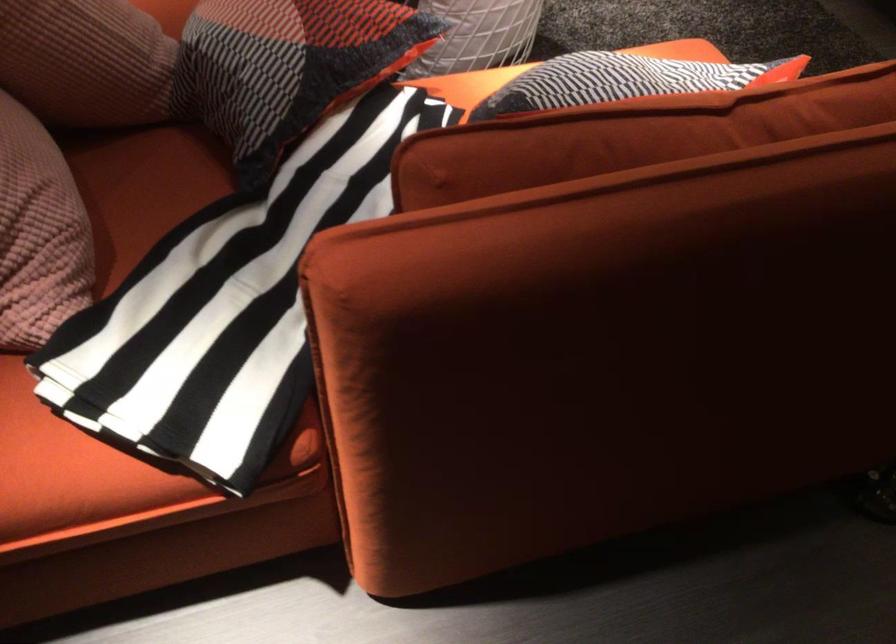
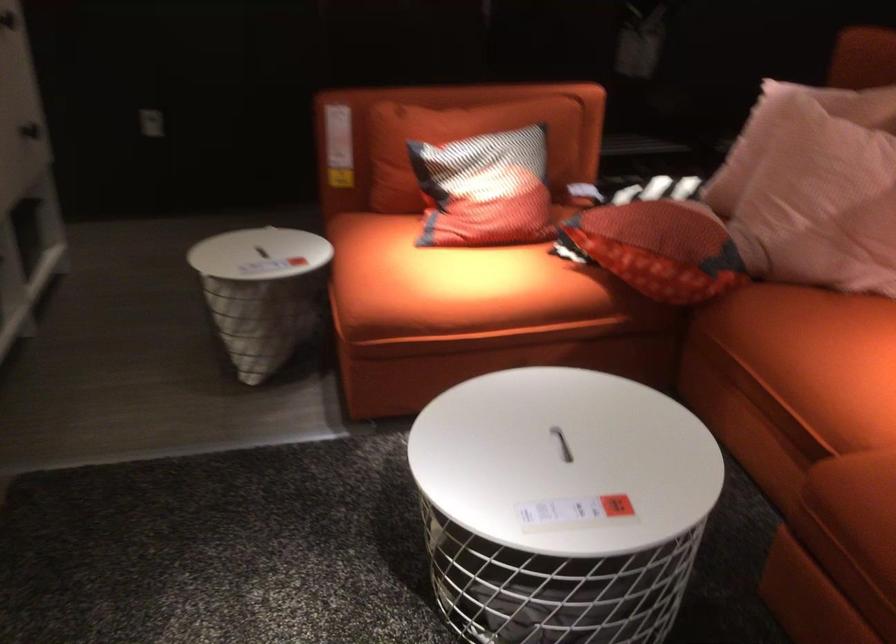
Find the pixel in the second image that matches point (581, 73) in the first image.

(485, 190)